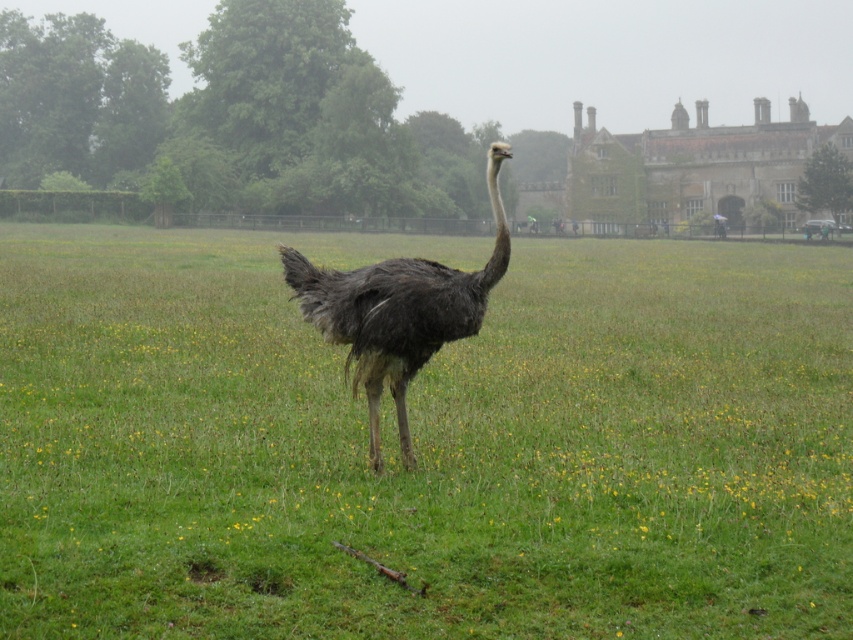
Question: Observing the image, what is the correct spatial positioning of green grassy field at center in reference to dark gray feathers ostrich at center?

Choices:
 (A) above
 (B) below

Answer: (A)

Question: Which point is closer to the camera taking this photo?

Choices:
 (A) (x=331, y=337)
 (B) (x=67, y=396)

Answer: (A)

Question: Is green grassy field at center positioned behind dark gray feathers ostrich at center?

Choices:
 (A) no
 (B) yes

Answer: (A)

Question: Which point is farther to the camera?

Choices:
 (A) (842, 588)
 (B) (483, 296)

Answer: (B)

Question: Does green grassy field at center have a lesser width compared to dark gray feathers ostrich at center?

Choices:
 (A) yes
 (B) no

Answer: (B)